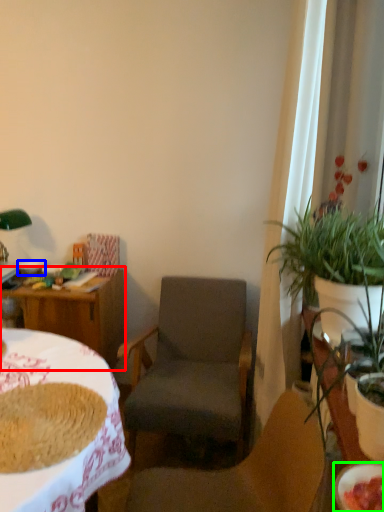
Question: Which is farther away from table (highlighted by a red box)? bowl (highlighted by a blue box) or bowl (highlighted by a green box)?

Choices:
 (A) bowl
 (B) bowl

Answer: (B)